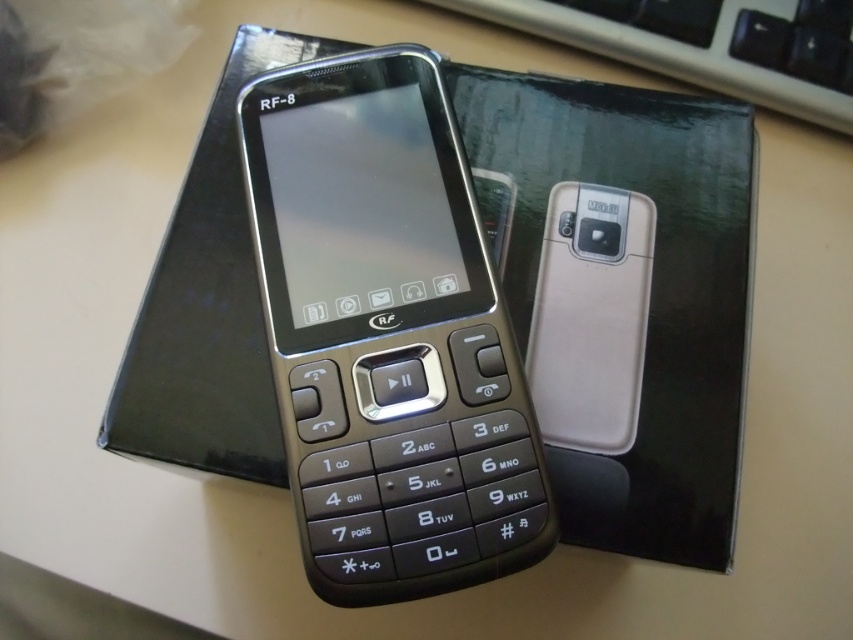
Question: Which point appears closest to the camera in this image?

Choices:
 (A) (474, 12)
 (B) (419, 172)

Answer: (B)

Question: From the image, what is the correct spatial relationship of matte black phone at center in relation to black plastic keyboard at upper center?

Choices:
 (A) right
 (B) left

Answer: (B)

Question: Does matte black phone at center appear on the right side of black plastic keyboard at upper center?

Choices:
 (A) yes
 (B) no

Answer: (B)

Question: Among these points, which one is nearest to the camera?

Choices:
 (A) [x=827, y=8]
 (B) [x=486, y=451]

Answer: (B)

Question: Is matte black phone at center to the left of black plastic keyboard at upper center from the viewer's perspective?

Choices:
 (A) no
 (B) yes

Answer: (B)